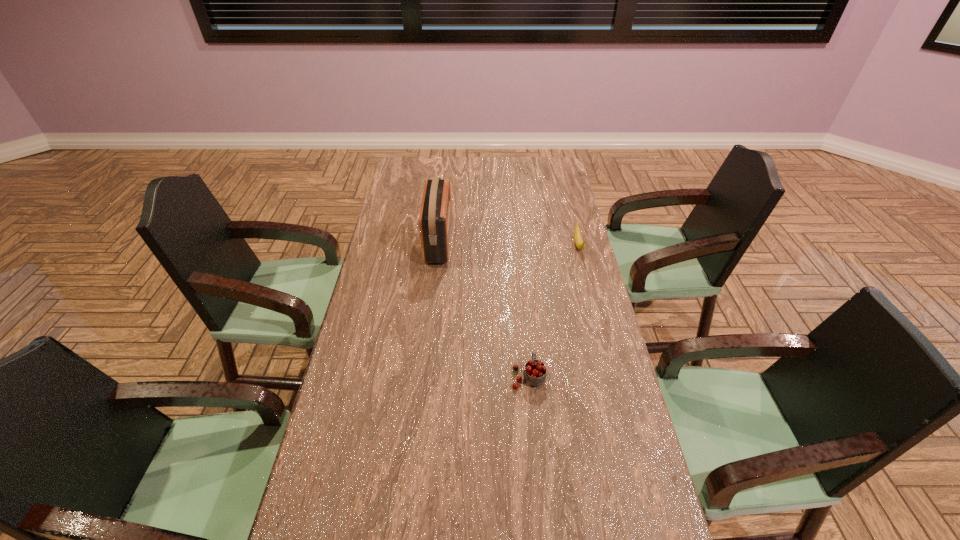
Where is `radio receiver`? Image resolution: width=960 pixels, height=540 pixels. radio receiver is located at coordinates (435, 220).

Image resolution: width=960 pixels, height=540 pixels. What are the coordinates of `the tallest object` in the screenshot? It's located at (435, 220).

Image resolution: width=960 pixels, height=540 pixels. Find the location of `the second object from left to right`. the second object from left to right is located at coordinates (535, 371).

In order to click on the second shortest object in this screenshot , I will do click(535, 371).

Image resolution: width=960 pixels, height=540 pixels. In order to click on banana in this screenshot , I will do `click(579, 242)`.

Image resolution: width=960 pixels, height=540 pixels. Identify the location of the rightmost object. (579, 242).

The height and width of the screenshot is (540, 960). In order to click on vacant area situated 0.390m on the front-facing side of the leftmost object in this screenshot , I will do `click(549, 242)`.

The height and width of the screenshot is (540, 960). I want to click on free region located 0.170m on the handle side of the nearest object, so click(523, 320).

This screenshot has width=960, height=540. I want to click on vacant space situated 0.340m on the handle side of the nearest object, so click(519, 284).

Identify the location of vacant region located 0.240m on the handle side of the nearest object. (521, 304).